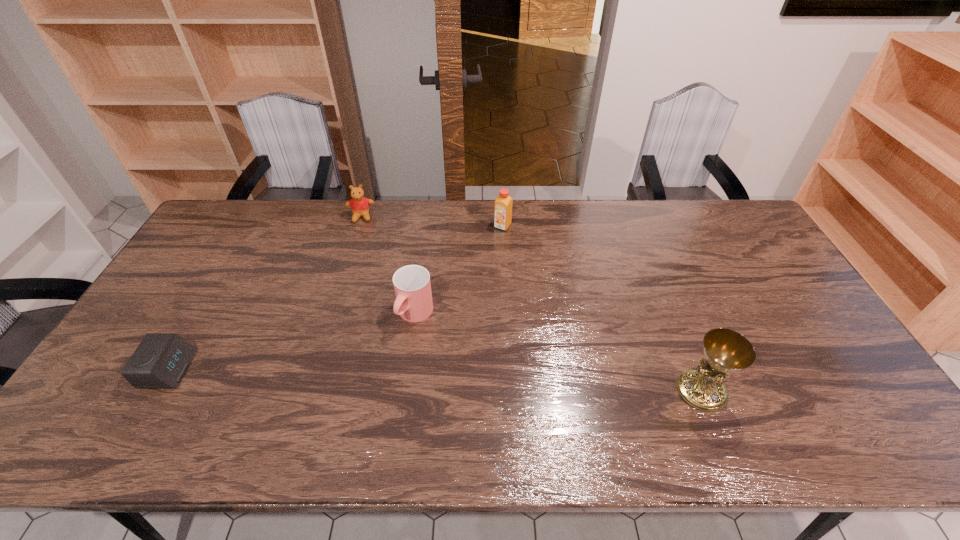
Locate an element on the screen. orange juice at the far edge is located at coordinates (503, 206).

Identify the location of alarm clock at the near edge. This screenshot has height=540, width=960. (160, 361).

Identify the location of chalice positioned at the near edge. (726, 351).

You are a GUI agent. You are given a task and a screenshot of the screen. Output one action in this format:
    pyautogui.click(x=<x>, y=<y>)
    Task: Click on the object that is at the left edge
    
    Given the screenshot: What is the action you would take?
    pyautogui.click(x=160, y=361)

Find the location of a particular element. The width and height of the screenshot is (960, 540). object at the near left corner is located at coordinates (160, 361).

This screenshot has height=540, width=960. In the image, there is a desktop. Identify the location of vacant space at the far edge. (444, 211).

In the image, there is a desktop. Where is `free region at the left edge`? free region at the left edge is located at coordinates (165, 323).

Locate an element on the screen. free space at the right edge is located at coordinates (735, 264).

Where is `vacant region between the tallest object and the orange juice`? This screenshot has height=540, width=960. vacant region between the tallest object and the orange juice is located at coordinates (602, 308).

The width and height of the screenshot is (960, 540). Find the location of `free spot between the third nearest object and the leftmost object`. free spot between the third nearest object and the leftmost object is located at coordinates (292, 342).